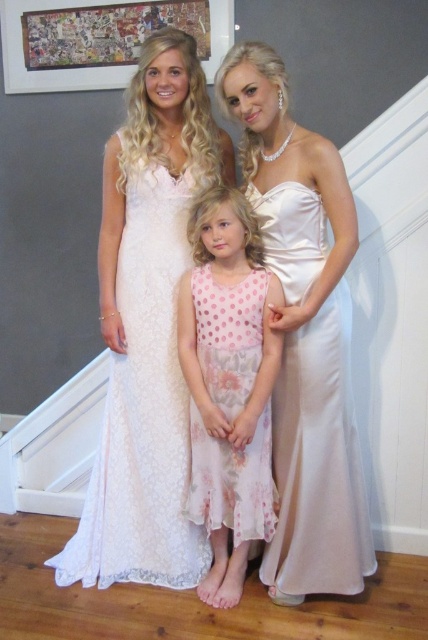
You are a photographer setting up for a photoshoot. You need to decide which dress to place higher in the frame to ensure both the satin dress at center and the pink floral dress at center are visible. Which dress should be positioned higher?

The satin dress at center should be positioned higher since it is shorter than the pink floral dress at center, allowing both dresses to be fully visible in the frame.

Consider the image. You are a photographer setting up for a group photo. You have two dresses in the scene, the lace fabric dress at center and the satin dress at center. Which dress do you need to adjust the camera angle for to ensure it fits entirely within the frame, considering their sizes?

The lace fabric dress at center is bigger than the satin dress at center, so you need to adjust the camera angle for the lace fabric dress at center to ensure it fits entirely within the frame.